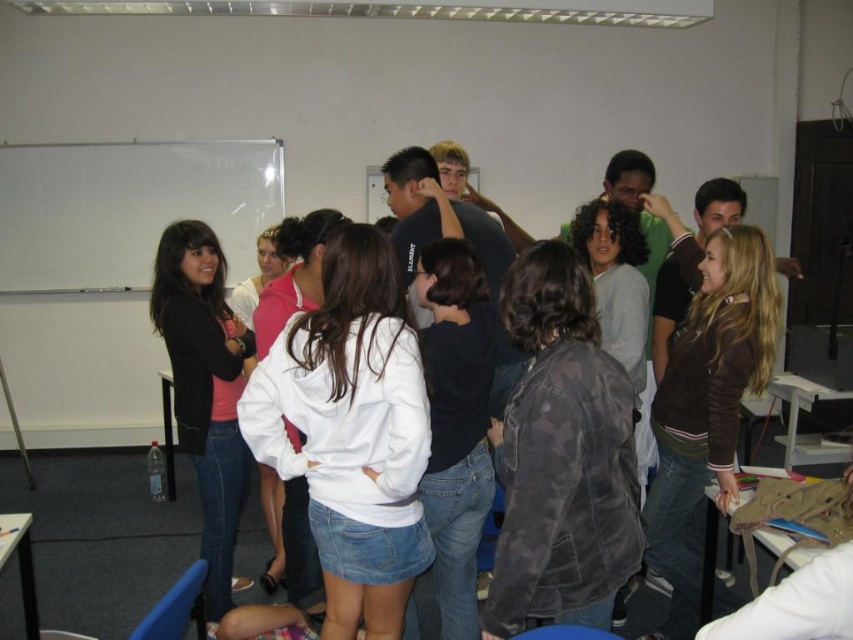
You are standing at the point marked as point (280, 344) in a classroom. If you want to take a photo of the whiteboard on the left side, which is blank and unmarked, will you be able to see the entire whiteboard in your camera view?

The distance between you and the camera is 6.50 feet. However, the whiteboard is on the left side of the room. Since the whiteboard is blank and unmarked, it might be challenging to determine if the entire whiteboard is visible in the camera view without knowing the camera angle or field of view. The provided information does not specify the camera angle or field of view, so it is uncertain if the entire whiteboard can be captured.

You are organizing a charity clothing drive and need to determine which jackets to prioritize based on size. Given the camouflage jacket at center and the brown suede jacket at center, which one should you choose if you need a larger jacket?

The brown suede jacket at center is larger than the camouflage jacket at center, so you should choose the brown suede jacket at center for a larger size.

You are organizing a charity clothing drive and need to determine which jackets can fit into a standard donation box. The brown suede jacket at center and the dark gray denim jacket at center are both candidates. Based on their sizes, which jacket is more likely to fit into a standard donation box?

The dark gray denim jacket at center is more likely to fit into a standard donation box since it has a smaller size compared to the brown suede jacket at center.